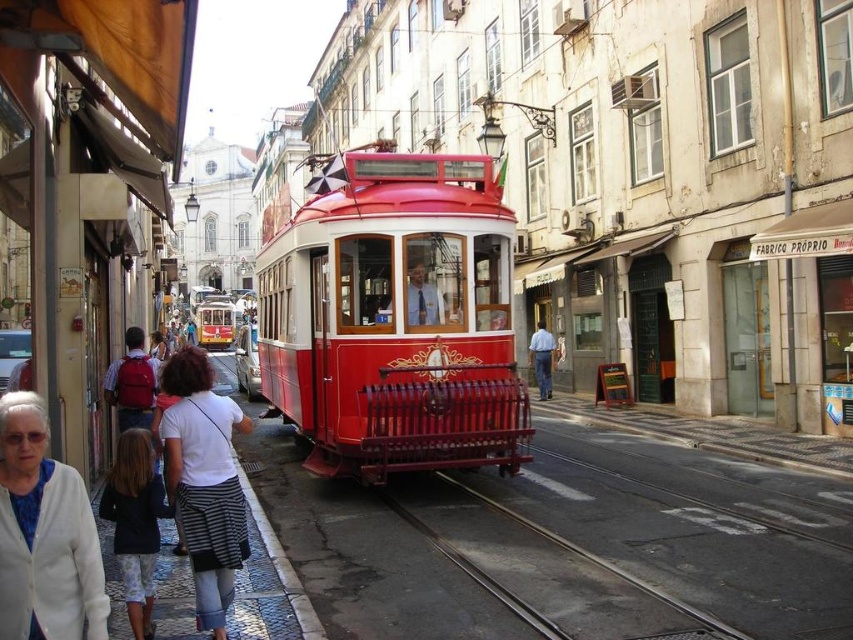
Question: Can you confirm if dark blue shirt at lower left is smaller than metallic gray track at center?

Choices:
 (A) yes
 (B) no

Answer: (B)

Question: Which point appears closest to the camera in this image?

Choices:
 (A) (387, 244)
 (B) (212, 477)
 (C) (155, 392)
 (D) (541, 356)

Answer: (B)

Question: Which of the following is the closest to the observer?

Choices:
 (A) (206, 515)
 (B) (534, 353)
 (C) (427, 288)
 (D) (733, 632)

Answer: (A)

Question: Can you confirm if dark blue shirt at lower left is positioned below matte white shirt at center?

Choices:
 (A) yes
 (B) no

Answer: (A)

Question: Which point is farther from the camera taking this photo?

Choices:
 (A) (395, 352)
 (B) (141, 556)
 (C) (444, 320)
 (D) (550, 355)

Answer: (D)

Question: Does red backpack at center have a greater width compared to blue jeans at center?

Choices:
 (A) yes
 (B) no

Answer: (A)